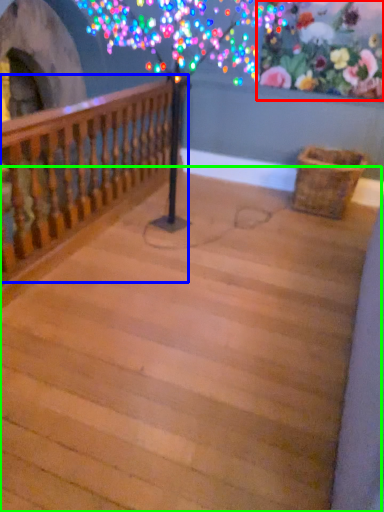
Question: Based on their relative distances, which object is farther from floral arrangement (highlighted by a red box)? Choose from rail (highlighted by a blue box) and stairwell (highlighted by a green box).

Choices:
 (A) rail
 (B) stairwell

Answer: (B)